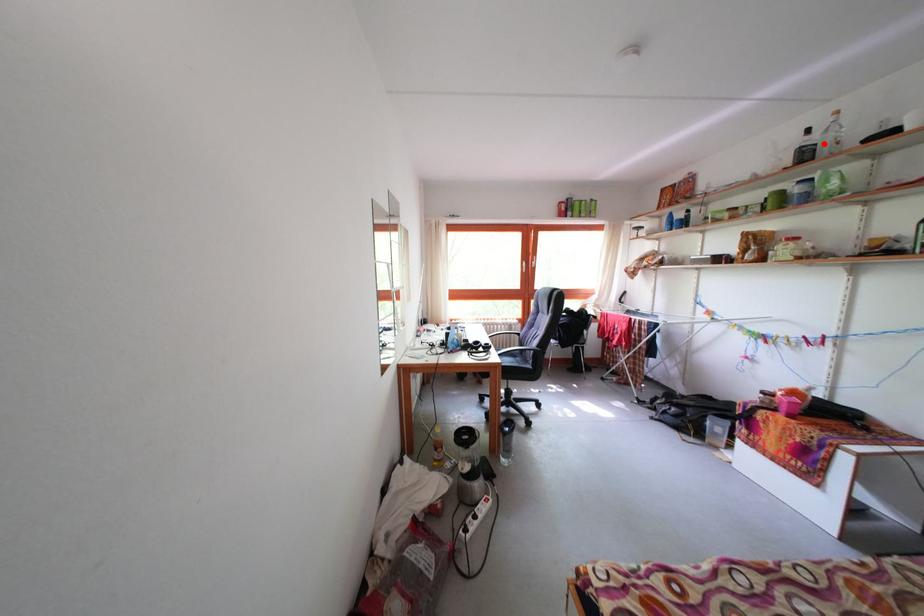
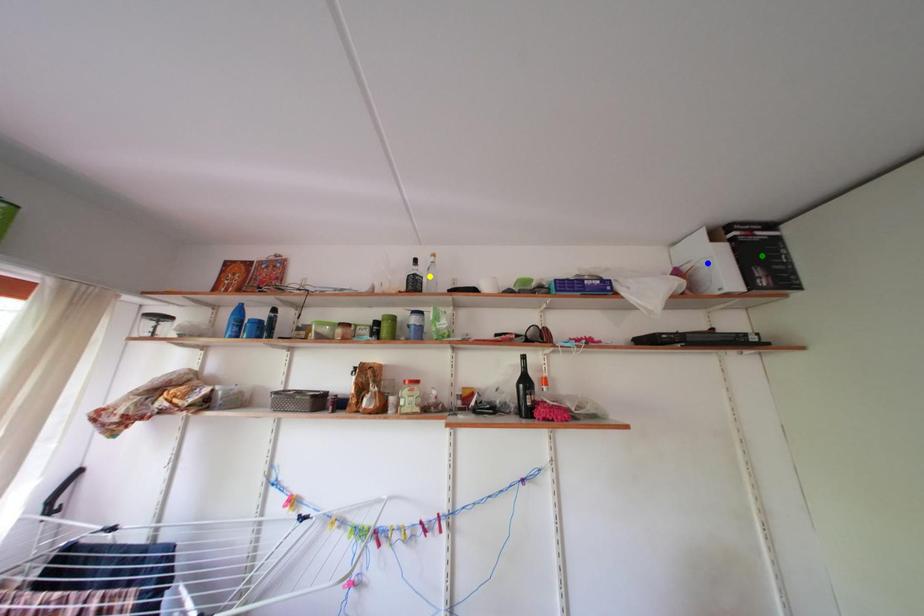
Question: I am providing you with two images of the same scene from different viewpoints. A red point is marked on the first image. You are given multiple points on the second image. Which spot in image 2 lines up with the point in image 1?

Choices:
 (A) blue point
 (B) yellow point
 (C) green point

Answer: (B)